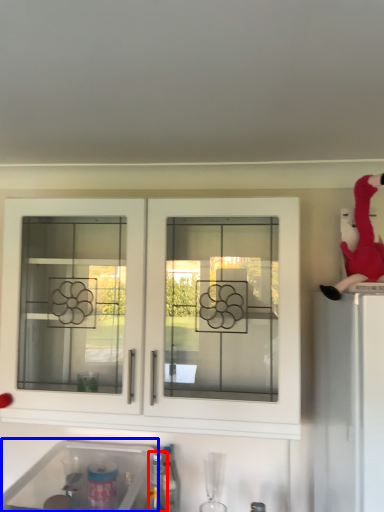
Question: Among these objects, which one is nearest to the camera, bottle (highlighted by a red box) or sink (highlighted by a blue box)?

Choices:
 (A) bottle
 (B) sink

Answer: (B)